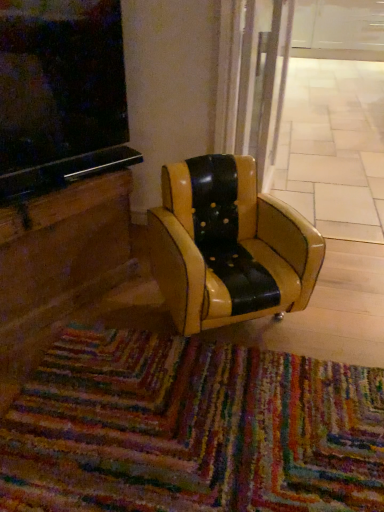
Question: Does black leather chair at center have a lesser height compared to transparent glass door at center?

Choices:
 (A) no
 (B) yes

Answer: (A)

Question: Is black leather chair at center not inside transparent glass door at center?

Choices:
 (A) yes
 (B) no

Answer: (A)

Question: Is black leather chair at center at the left side of transparent glass door at center?

Choices:
 (A) no
 (B) yes

Answer: (B)

Question: From the image's perspective, does black leather chair at center appear higher than transparent glass door at center?

Choices:
 (A) no
 (B) yes

Answer: (A)

Question: Is black leather chair at center further to camera compared to transparent glass door at center?

Choices:
 (A) yes
 (B) no

Answer: (B)

Question: Does black leather chair at center have a greater width compared to transparent glass door at center?

Choices:
 (A) yes
 (B) no

Answer: (B)

Question: From a real-world perspective, is black leather chair at center beneath multicolored woven mat at lower center?

Choices:
 (A) no
 (B) yes

Answer: (A)

Question: Does black leather chair at center touch multicolored woven mat at lower center?

Choices:
 (A) no
 (B) yes

Answer: (A)

Question: Considering the relative sizes of black leather chair at center and multicolored woven mat at lower center in the image provided, is black leather chair at center thinner than multicolored woven mat at lower center?

Choices:
 (A) yes
 (B) no

Answer: (A)

Question: Can you confirm if black leather chair at center is wider than multicolored woven mat at lower center?

Choices:
 (A) yes
 (B) no

Answer: (B)

Question: Does black leather chair at center appear on the right side of multicolored woven mat at lower center?

Choices:
 (A) no
 (B) yes

Answer: (B)

Question: Is multicolored woven mat at lower center surrounded by black leather chair at center?

Choices:
 (A) no
 (B) yes

Answer: (A)

Question: Is the depth of multicolored woven mat at lower center greater than that of transparent glass door at center?

Choices:
 (A) no
 (B) yes

Answer: (A)